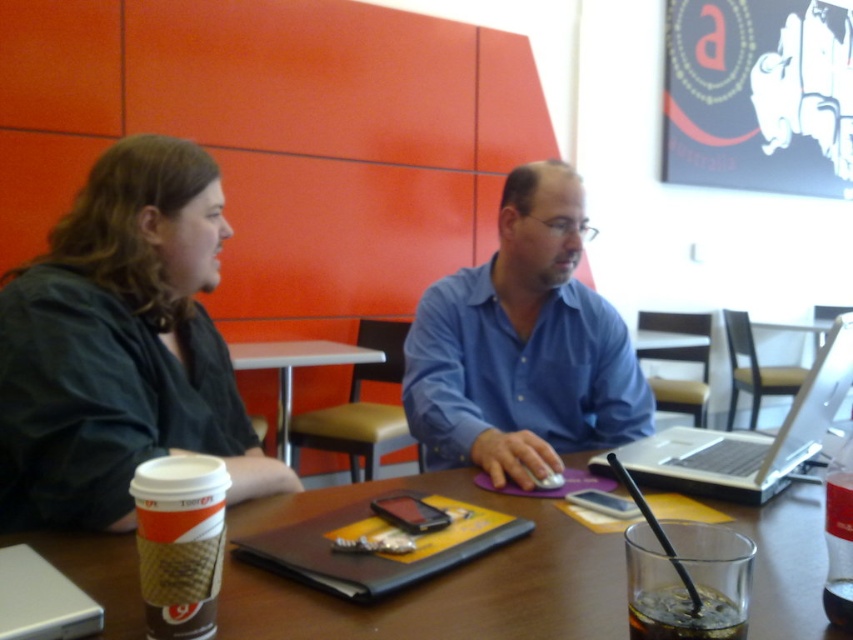
Question: Which is nearer to the brown wooden table at center?

Choices:
 (A) silver metallic laptop at center
 (B) dark green shirt at left
 (C) brown leather table at center

Answer: (B)

Question: Does dark green shirt at left appear on the right side of brown leather table at center?

Choices:
 (A) yes
 (B) no

Answer: (A)

Question: Which point is closer to the camera?

Choices:
 (A) (277, 392)
 (B) (718, 628)

Answer: (B)

Question: Can you confirm if dark green shirt at left is positioned below translucent plastic cup at lower center?

Choices:
 (A) no
 (B) yes

Answer: (A)

Question: Which object is farther from the camera taking this photo?

Choices:
 (A) translucent plastic cup at lower center
 (B) brown leather table at center

Answer: (B)

Question: Can you confirm if silver metallic laptop at center is bigger than translucent plastic cup at lower center?

Choices:
 (A) yes
 (B) no

Answer: (A)